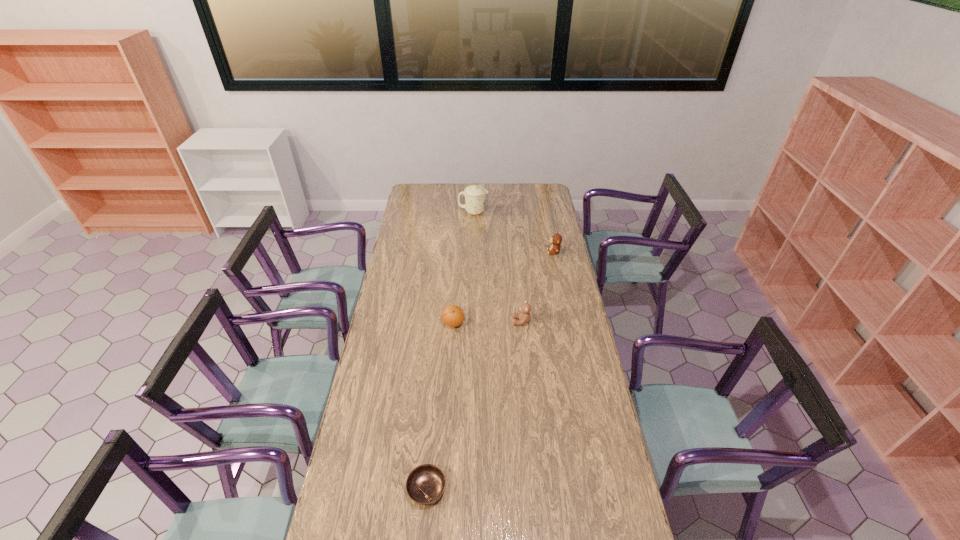
In the image, there is a desktop. What are the coordinates of `vacant space at the right edge` in the screenshot? It's located at (610, 524).

In the image, there is a desktop. Where is `vacant space at the far left corner`? The width and height of the screenshot is (960, 540). vacant space at the far left corner is located at coordinates (413, 195).

Find the location of a particular element. The height and width of the screenshot is (540, 960). vacant space at the far right corner of the desktop is located at coordinates (530, 189).

What are the coordinates of `free point between the second farthest object and the farthest object` in the screenshot? It's located at (514, 232).

The width and height of the screenshot is (960, 540). Find the location of `free space between the orange and the farthest object`. free space between the orange and the farthest object is located at coordinates (463, 268).

Identify the location of vacant area between the orange and the farther teddy bear. (503, 288).

This screenshot has width=960, height=540. Find the location of `empty space that is in between the fourth object from left to right and the soup bowl`. empty space that is in between the fourth object from left to right and the soup bowl is located at coordinates (474, 406).

Find the location of a particular element. The image size is (960, 540). free spot between the farthest object and the orange is located at coordinates [463, 268].

You are a GUI agent. You are given a task and a screenshot of the screen. Output one action in this format:
    pyautogui.click(x=<x>, y=<y>)
    Task: Click on the free area in between the soup bowl and the left teddy bear
    
    Given the screenshot: What is the action you would take?
    pyautogui.click(x=474, y=406)

Where is `free space between the left teddy bear and the rightmost object`? Image resolution: width=960 pixels, height=540 pixels. free space between the left teddy bear and the rightmost object is located at coordinates (538, 287).